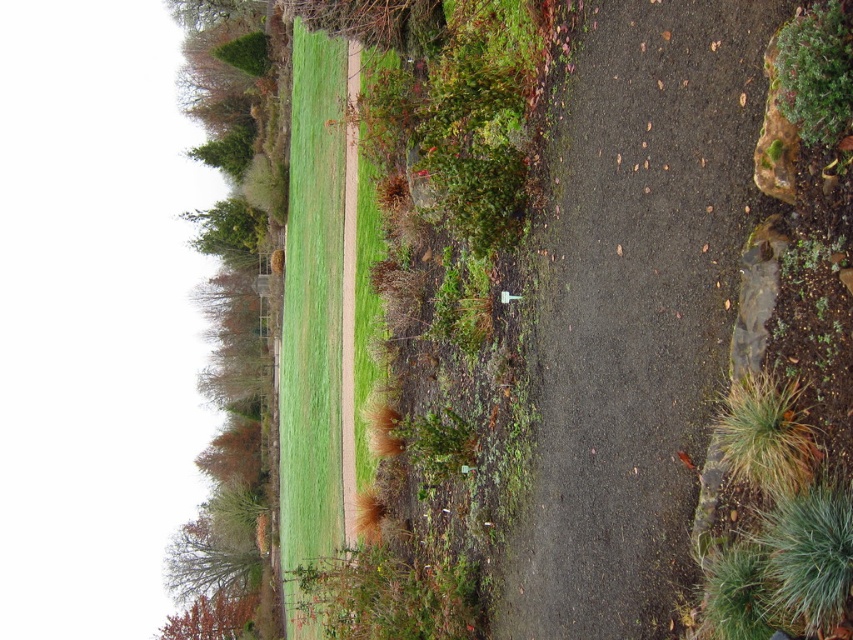
Can you confirm if green grass at center is wider than brown fuzzy grass at lower right?

Answer: Yes, green grass at center is wider than brown fuzzy grass at lower right.

Which of these two, green grass at center or brown fuzzy grass at lower right, stands shorter?

Standing shorter between the two is brown fuzzy grass at lower right.

Between point (334, 124) and point (801, 465), which one is positioned in front?

Point (801, 465) is in front.

The image size is (853, 640). I want to click on green grass at center, so click(312, 305).